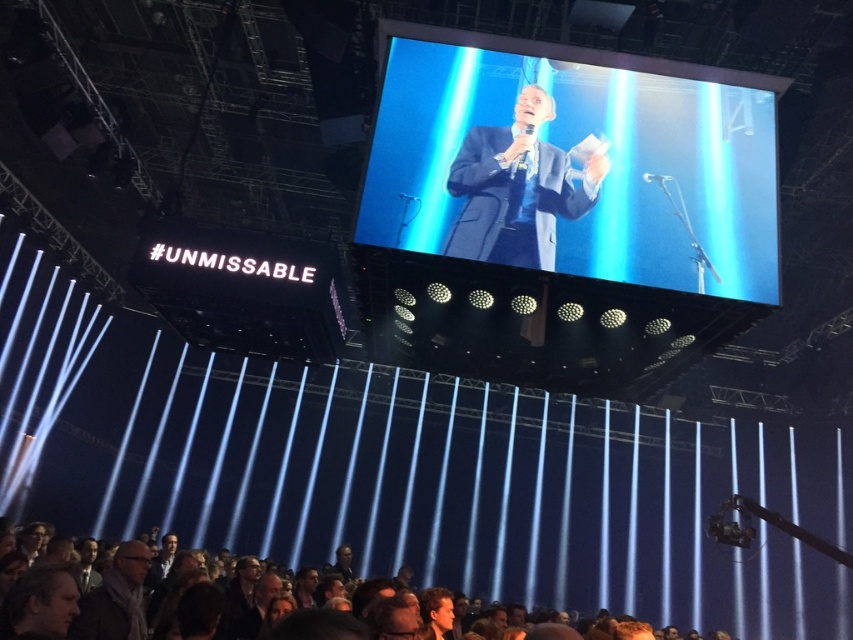
Question: Which object is closer to the camera taking this photo?

Choices:
 (A) dark blue suit at center
 (B) dark gray scarf at lower left

Answer: (B)

Question: Does shiny blue screen at center have a smaller size compared to dark gray scarf at lower left?

Choices:
 (A) yes
 (B) no

Answer: (B)

Question: Considering the relative positions of dark brown leather jacket at lower center and dark blue suit at center in the image provided, where is dark brown leather jacket at lower center located with respect to dark blue suit at center?

Choices:
 (A) right
 (B) left

Answer: (B)

Question: Estimate the real-world distances between objects in this image. Which object is farther from the shiny blue screen at center?

Choices:
 (A) dark blue suit at center
 (B) dark brown leather jacket at lower center
 (C) dark gray scarf at lower left

Answer: (B)

Question: Which point is closer to the camera taking this photo?

Choices:
 (A) (144, 624)
 (B) (715, 221)

Answer: (A)

Question: Is dark blue suit at center further to the viewer compared to dark gray scarf at lower left?

Choices:
 (A) no
 (B) yes

Answer: (B)